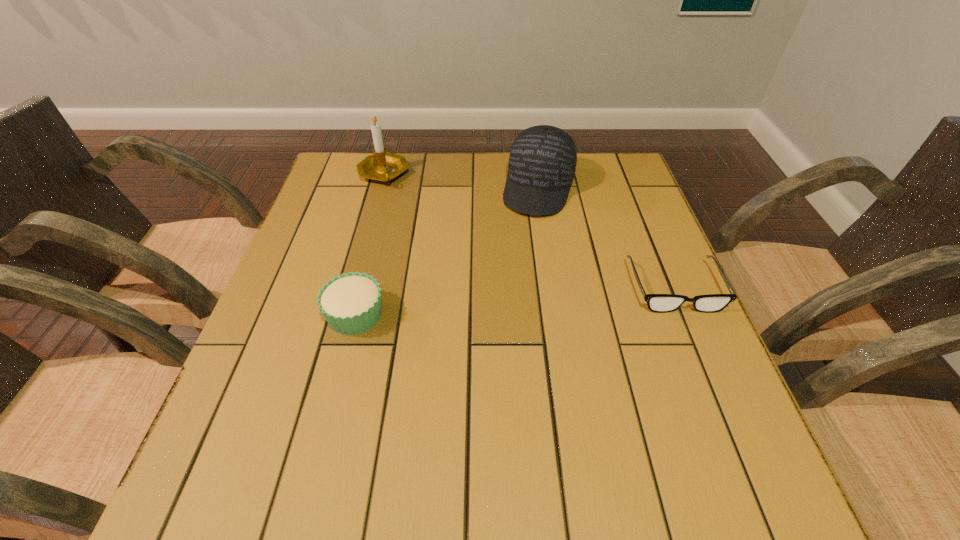
I want to click on cupcake, so tap(351, 303).

In order to click on the shortest object in this screenshot , I will do `click(661, 303)`.

Locate an element on the screen. The width and height of the screenshot is (960, 540). the rightmost object is located at coordinates (661, 303).

Where is `candle holder`? Image resolution: width=960 pixels, height=540 pixels. candle holder is located at coordinates (382, 166).

Locate an element on the screen. The width and height of the screenshot is (960, 540). baseball cap is located at coordinates (542, 162).

At what (x,y) coordinates should I click in order to perform the action: click on vacant space situated on the right of the cupcake. Please return your answer as a coordinate pair (x, y). Looking at the image, I should click on (439, 315).

Where is `vacant space positioned 0.080m on the front-facing side of the rightmost object`? Image resolution: width=960 pixels, height=540 pixels. vacant space positioned 0.080m on the front-facing side of the rightmost object is located at coordinates (699, 346).

Where is `free location located 0.120m with a handle on the candle holder`? This screenshot has width=960, height=540. free location located 0.120m with a handle on the candle holder is located at coordinates (424, 206).

Where is `free space located with a handle on the candle holder`? The height and width of the screenshot is (540, 960). free space located with a handle on the candle holder is located at coordinates (447, 224).

Locate an element on the screen. free spot located with a handle on the candle holder is located at coordinates (422, 204).